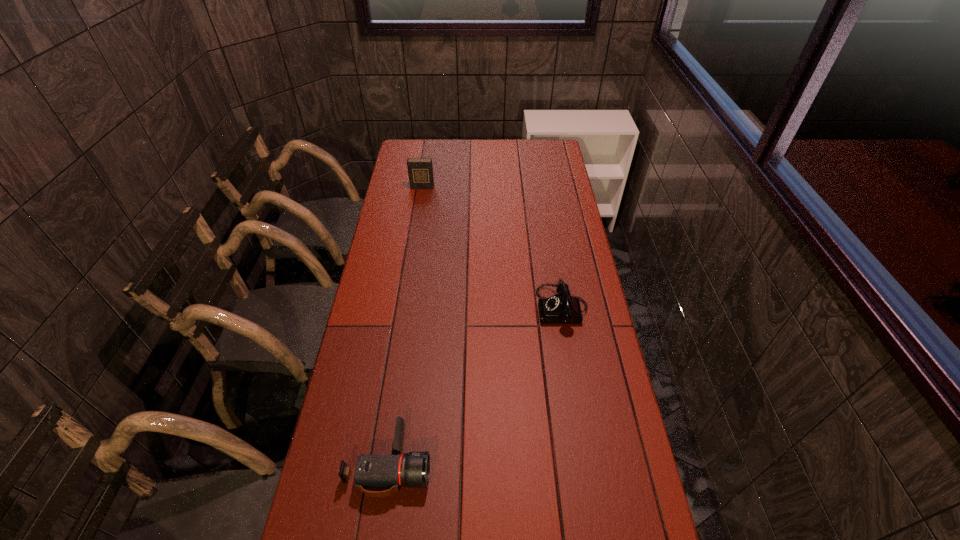
This screenshot has height=540, width=960. What are the coordinates of `diary` in the screenshot? It's located at (420, 170).

What are the coordinates of `the tallest object` in the screenshot? It's located at (420, 170).

You are a GUI agent. You are given a task and a screenshot of the screen. Output one action in this format:
    pyautogui.click(x=<x>, y=<y>)
    Task: Click on the second farthest object
    
    Given the screenshot: What is the action you would take?
    pyautogui.click(x=562, y=308)

You are a GUI agent. You are given a task and a screenshot of the screen. Output one action in this format:
    pyautogui.click(x=<x>, y=<y>)
    Task: Click on the telephone
    
    Given the screenshot: What is the action you would take?
    pyautogui.click(x=562, y=308)

Locate an element on the screen. camcorder is located at coordinates (372, 472).

The height and width of the screenshot is (540, 960). Find the location of `the nearest object`. the nearest object is located at coordinates (372, 472).

Find the location of a particular element. This screenshot has width=960, height=540. free space located on the front cover of the diary is located at coordinates (420, 202).

Identify the location of free spot located 0.080m on the dial of the telephone. Image resolution: width=960 pixels, height=540 pixels. (515, 308).

Locate an element on the screen. free space located on the dial of the telephone is located at coordinates (456, 308).

Locate an element on the screen. vacant region located on the dial of the telephone is located at coordinates (479, 308).